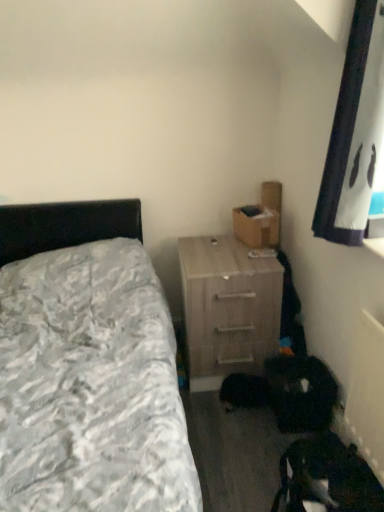
Identify the location of textured gray bedspread at left. The height and width of the screenshot is (512, 384). (88, 366).

At what (x,y) coordinates should I click in order to perform the action: click on brown cardboard box at upper right. Please return your answer as a coordinate pair (x, y). This screenshot has width=384, height=512. Looking at the image, I should click on (260, 219).

Describe the element at coordinates (260, 219) in the screenshot. I see `brown cardboard box at upper right` at that location.

Where is `textured gray bedspread at left`? The image size is (384, 512). textured gray bedspread at left is located at coordinates (88, 366).

Considering the positions of objects textured gray bedspread at left and brown cardboard box at upper right in the image provided, who is in front, textured gray bedspread at left or brown cardboard box at upper right?

textured gray bedspread at left is more forward.

Which is in front, point (45, 381) or point (241, 225)?

The point (45, 381) is closer.

How different are the orientations of textured gray bedspread at left and brown cardboard box at upper right in degrees?

There is a 75.9-degree angle between the facing directions of textured gray bedspread at left and brown cardboard box at upper right.

Could you tell me if textured gray bedspread at left is facing brown cardboard box at upper right?

No, textured gray bedspread at left does not turn towards brown cardboard box at upper right.

From the image's perspective, relative to light wood/texture nightstand at center-right, is brown cardboard box at upper right above or below?

Clearly, from the image's perspective, brown cardboard box at upper right is above light wood/texture nightstand at center-right.

Considering the positions of points (262, 231) and (224, 316), is point (262, 231) closer to camera compared to point (224, 316)?

No, it is not.

Consider the image. Which of these two, brown cardboard box at upper right or light wood/texture nightstand at center-right, is bigger?

light wood/texture nightstand at center-right is bigger.

Where is `bed that appears in front of the light wood/texture nightstand at center-right`? bed that appears in front of the light wood/texture nightstand at center-right is located at coordinates 88,366.

From the image's perspective, which is below, light wood/texture nightstand at center-right or textured gray bedspread at left?

textured gray bedspread at left appears lower in the image.

Between light wood/texture nightstand at center-right and textured gray bedspread at left, which one has larger size?

textured gray bedspread at left is bigger.

Which of these two, light wood/texture nightstand at center-right or textured gray bedspread at left, stands taller?

With more height is textured gray bedspread at left.

Does textured gray bedspread at left have a lesser height compared to light wood/texture nightstand at center-right?

No, textured gray bedspread at left is not shorter than light wood/texture nightstand at center-right.

Is textured gray bedspread at left placed right next to light wood/texture nightstand at center-right?

There is a gap between textured gray bedspread at left and light wood/texture nightstand at center-right.

The width and height of the screenshot is (384, 512). Identify the location of nightstand behind the textured gray bedspread at left. (228, 308).

How many degrees apart are the facing directions of textured gray bedspread at left and light wood/texture nightstand at center-right?

The angle between the facing direction of textured gray bedspread at left and the facing direction of light wood/texture nightstand at center-right is 1.09 degrees.

Considering the relative sizes of brown cardboard box at upper right and textured gray bedspread at left in the image provided, is brown cardboard box at upper right thinner than textured gray bedspread at left?

Yes.

From a real-world perspective, between brown cardboard box at upper right and textured gray bedspread at left, who is vertically higher?

brown cardboard box at upper right.

Is point (238, 232) less distant than point (130, 468)?

That is False.

From the image's perspective, who appears lower, light wood/texture nightstand at center-right or brown cardboard box at upper right?

light wood/texture nightstand at center-right.

Choose the correct answer: Is light wood/texture nightstand at center-right inside brown cardboard box at upper right or outside it?

light wood/texture nightstand at center-right is not enclosed by brown cardboard box at upper right.

In the image, is light wood/texture nightstand at center-right positioned in front of or behind brown cardboard box at upper right?

light wood/texture nightstand at center-right is positioned closer to the viewer than brown cardboard box at upper right.

What are the coordinates of `cardboard box above the light wood/texture nightstand at center-right (from the image's perspective)` in the screenshot? It's located at (260, 219).

Where is `bed located in front of the brown cardboard box at upper right`? Image resolution: width=384 pixels, height=512 pixels. bed located in front of the brown cardboard box at upper right is located at coordinates (88, 366).

Find the location of a particular element. Image resolution: width=384 pixels, height=512 pixels. cardboard box behind the light wood/texture nightstand at center-right is located at coordinates (260, 219).

Looking at the image, which one is located further to textured gray bedspread at left, brown cardboard box at upper right or light wood/texture nightstand at center-right?

brown cardboard box at upper right.

Looking at the image, which one is located closer to brown cardboard box at upper right, textured gray bedspread at left or light wood/texture nightstand at center-right?

light wood/texture nightstand at center-right is positioned closer to the anchor brown cardboard box at upper right.

Considering their positions, is brown cardboard box at upper right positioned closer to light wood/texture nightstand at center-right than textured gray bedspread at left?

brown cardboard box at upper right is closer to light wood/texture nightstand at center-right.

Based on their spatial positions, is light wood/texture nightstand at center-right or textured gray bedspread at left closer to brown cardboard box at upper right?

Based on the image, light wood/texture nightstand at center-right appears to be nearer to brown cardboard box at upper right.

Which object lies nearer to the anchor point textured gray bedspread at left, light wood/texture nightstand at center-right or brown cardboard box at upper right?

The object closer to textured gray bedspread at left is light wood/texture nightstand at center-right.

Considering their positions, is textured gray bedspread at left positioned closer to light wood/texture nightstand at center-right than brown cardboard box at upper right?

brown cardboard box at upper right is closer to light wood/texture nightstand at center-right.

Identify the location of nightstand between textured gray bedspread at left and brown cardboard box at upper right from front to back. (228, 308).